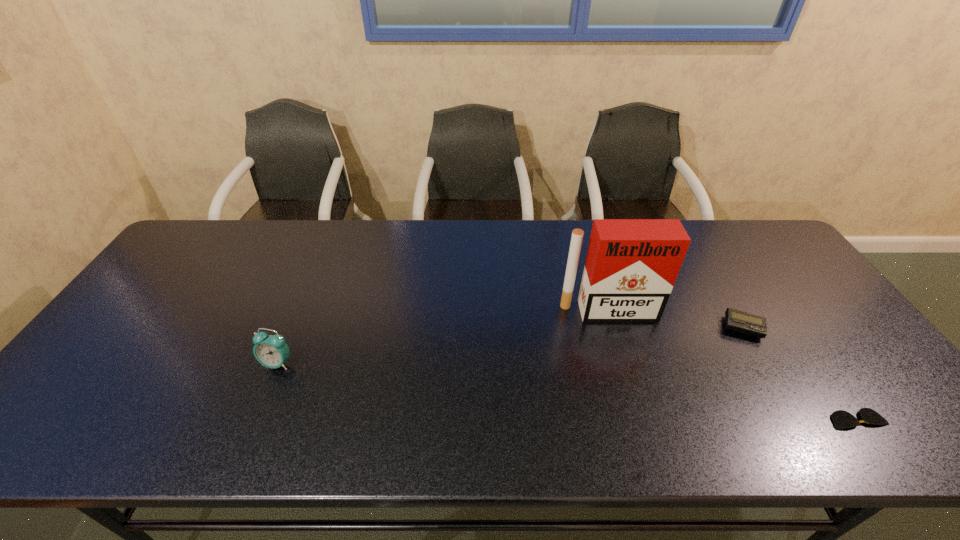
Locate an element on the screen. Image resolution: width=960 pixels, height=540 pixels. free spot between the second shortest object and the spectacles is located at coordinates (800, 374).

I want to click on vacant point located between the shortest object and the third object from left to right, so click(x=800, y=374).

Image resolution: width=960 pixels, height=540 pixels. Identify the location of object identified as the second closest to the third object from right to left. (842, 419).

I want to click on the third closest object to the second tallest object, so click(x=842, y=419).

This screenshot has width=960, height=540. Find the location of `free location that satisfies the following two spatial constraints: 1. on the face of the third shortest object; 2. on the right side of the spectacles`. free location that satisfies the following two spatial constraints: 1. on the face of the third shortest object; 2. on the right side of the spectacles is located at coordinates (254, 420).

This screenshot has height=540, width=960. What are the coordinates of `vacant area in the image that satisfies the following two spatial constraints: 1. on the face of the third shortest object; 2. on the right side of the shortest object` in the screenshot? It's located at (254, 420).

At what (x,y) coordinates should I click in order to perform the action: click on free location that satisfies the following two spatial constraints: 1. on the front-facing side of the beeper; 2. on the left side of the cigarette case. Please return your answer as a coordinate pair (x, y). The height and width of the screenshot is (540, 960). Looking at the image, I should click on (613, 327).

I want to click on free space in the image that satisfies the following two spatial constraints: 1. on the front-facing side of the spectacles; 2. on the right side of the cigarette case, so click(x=640, y=420).

Locate an element on the screen. The width and height of the screenshot is (960, 540). blank space that satisfies the following two spatial constraints: 1. on the face of the alarm clock; 2. on the right side of the shortest object is located at coordinates (254, 420).

Locate an element on the screen. The image size is (960, 540). free region that satisfies the following two spatial constraints: 1. on the face of the nearest object; 2. on the left side of the leftmost object is located at coordinates (254, 420).